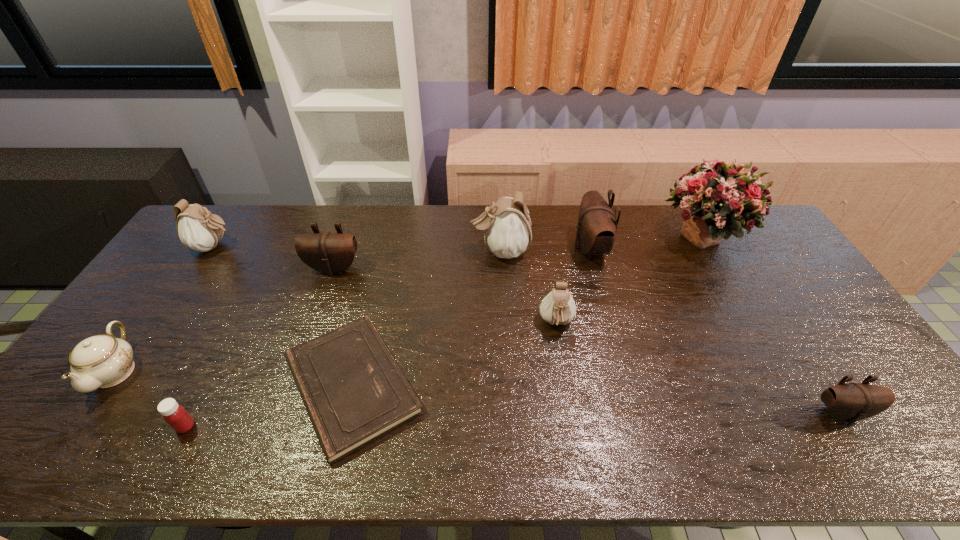
The height and width of the screenshot is (540, 960). Find the location of `the tallest object`. the tallest object is located at coordinates coord(718,198).

This screenshot has width=960, height=540. Identify the location of pink bouquet. (718, 198).

This screenshot has width=960, height=540. I want to click on the biggest white pouch, so click(x=506, y=224).

Where is `the eighth object from left to right`? the eighth object from left to right is located at coordinates (597, 225).

Where is `the second brown pouch from left to right`? The height and width of the screenshot is (540, 960). the second brown pouch from left to right is located at coordinates (597, 225).

The height and width of the screenshot is (540, 960). What are the coordinates of `the second biggest white pouch` in the screenshot? It's located at (197, 228).

Locate an element on the screen. The width and height of the screenshot is (960, 540). the leftmost pouch is located at coordinates (197, 228).

At what (x,y) coordinates should I click in order to perform the action: click on the second biggest brown pouch. Please return your answer as a coordinate pair (x, y). The image size is (960, 540). Looking at the image, I should click on (326, 252).

Identify the location of the leftmost brown pouch. (326, 252).

I want to click on the nearest white pouch, so click(x=558, y=307).